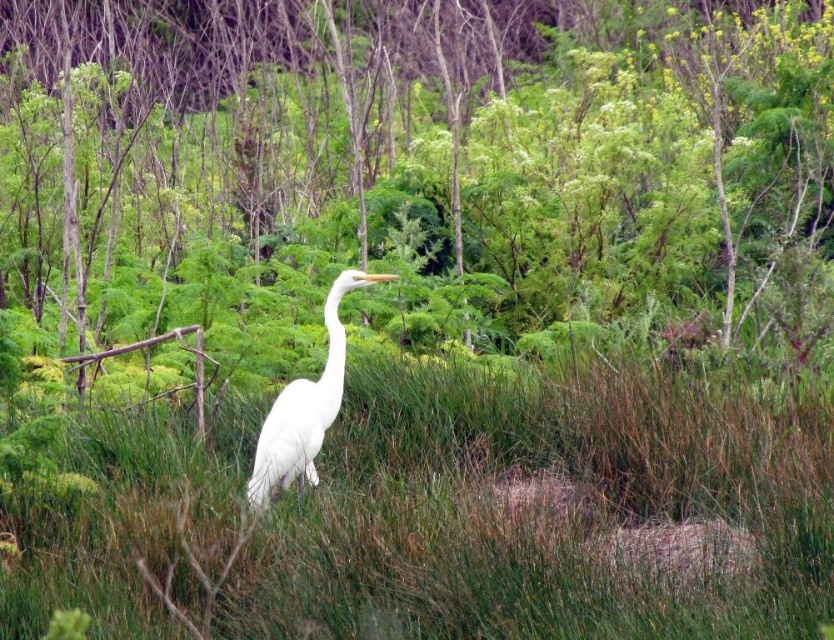
Question: Which point is farther to the camera?

Choices:
 (A) (x=378, y=278)
 (B) (x=827, y=419)

Answer: (B)

Question: Does green leafy tree at center have a smaller size compared to green grassy at center?

Choices:
 (A) yes
 (B) no

Answer: (B)

Question: Is green leafy tree at center positioned before green grassy at center?

Choices:
 (A) no
 (B) yes

Answer: (A)

Question: Estimate the real-world distances between objects in this image. Which object is farther from the green leafy tree at center?

Choices:
 (A) white matte bird at center
 (B) green grassy at center

Answer: (A)

Question: Which of the following is the farthest from the observer?

Choices:
 (A) 305,472
 (B) 615,272
 (C) 66,595

Answer: (B)

Question: From the image, what is the correct spatial relationship of green leafy tree at center in relation to green grassy at center?

Choices:
 (A) above
 (B) below

Answer: (A)